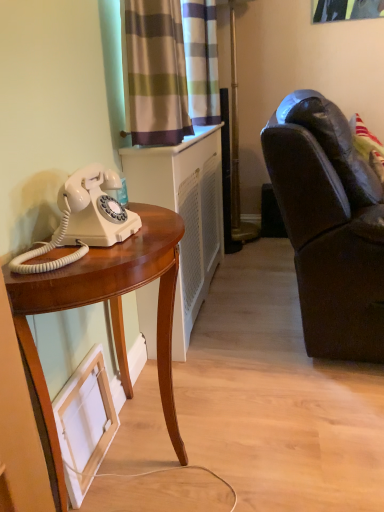
The width and height of the screenshot is (384, 512). What are the coordinates of `free space in front of white plastic radiator at center` in the screenshot? It's located at (262, 381).